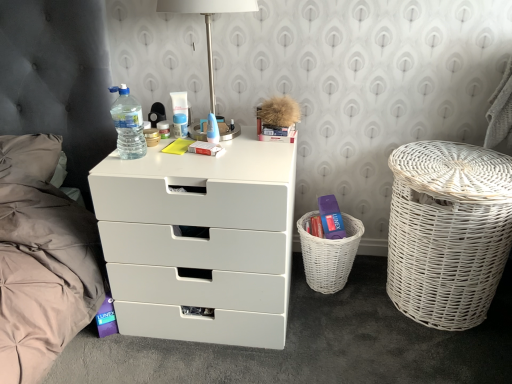
Locate an element on the screen. free space behind translucent plastic tube at center, which is the third toiletry in right-to-left order is located at coordinates (175, 120).